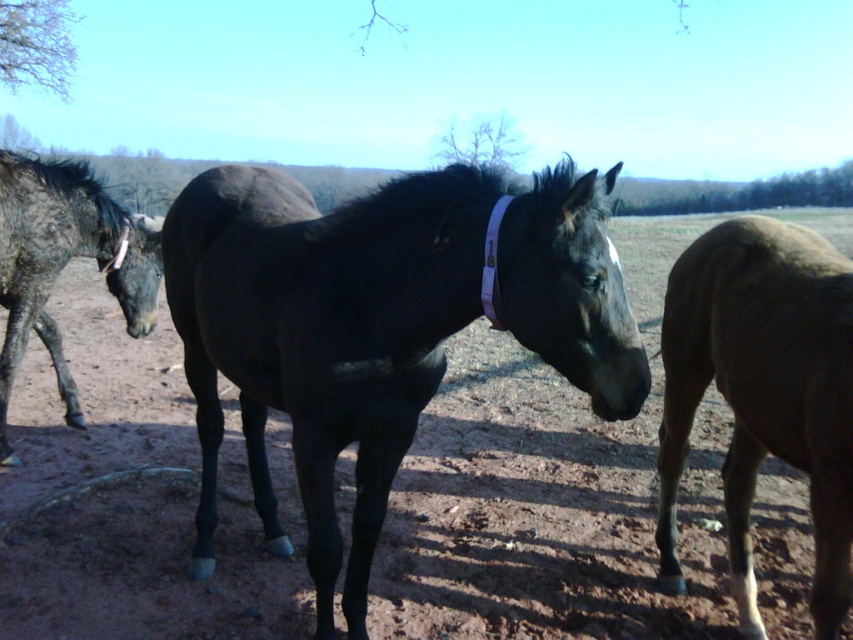
Is black glossy horse at center positioned in front of brown matte horse at right?

Yes, it is in front of brown matte horse at right.

Where is `black glossy horse at center`? This screenshot has height=640, width=853. black glossy horse at center is located at coordinates (379, 326).

This screenshot has height=640, width=853. I want to click on black glossy horse at center, so click(x=379, y=326).

Can you confirm if black glossy horse at center is taller than speckled dark fur horse at left?

No.

Does black glossy horse at center appear under speckled dark fur horse at left?

Indeed, black glossy horse at center is positioned under speckled dark fur horse at left.

Is point (437, 308) farther from camera compared to point (140, 291)?

No, it is not.

The width and height of the screenshot is (853, 640). In order to click on black glossy horse at center in this screenshot , I will do `click(379, 326)`.

Can you confirm if brown matte horse at right is bigger than speckled dark fur horse at left?

No.

Is brown matte horse at right to the left of speckled dark fur horse at left from the viewer's perspective?

Incorrect, brown matte horse at right is not on the left side of speckled dark fur horse at left.

What do you see at coordinates (763, 394) in the screenshot? The height and width of the screenshot is (640, 853). I see `brown matte horse at right` at bounding box center [763, 394].

You are a GUI agent. You are given a task and a screenshot of the screen. Output one action in this format:
    pyautogui.click(x=<x>, y=<y>)
    Task: Click on the brown matte horse at right
    Image resolution: width=853 pixels, height=640 pixels.
    Given the screenshot: What is the action you would take?
    pyautogui.click(x=763, y=394)